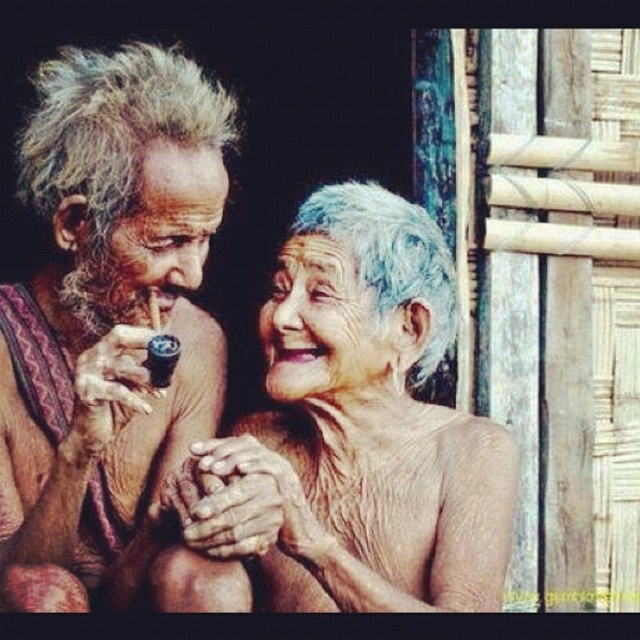
Question: Among these objects, which one is nearest to the camera?

Choices:
 (A) brown textured cloth at left
 (B) gray textured hair at center

Answer: (A)

Question: Where is brown textured cloth at left located in relation to gray textured hair at center in the image?

Choices:
 (A) below
 (B) above

Answer: (B)

Question: Can you confirm if brown textured cloth at left is smaller than gray textured hair at center?

Choices:
 (A) yes
 (B) no

Answer: (A)

Question: Does brown textured cloth at left appear over gray textured hair at center?

Choices:
 (A) no
 (B) yes

Answer: (B)

Question: Among these points, which one is farthest from the camera?

Choices:
 (A) (61, 493)
 (B) (417, 275)

Answer: (B)